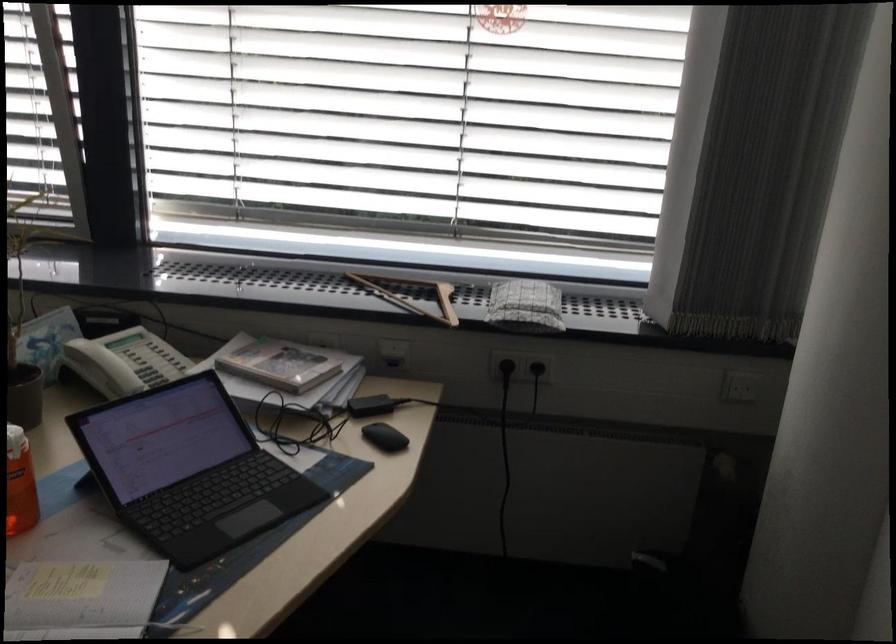
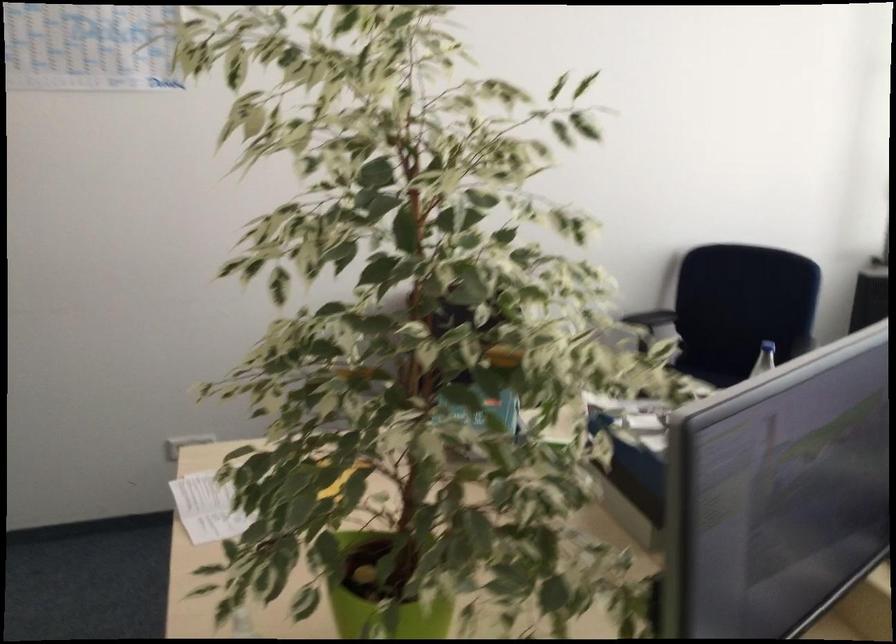
Question: The camera is either moving clockwise (left) or counter-clockwise (right) around the object. The first image is from the beginning of the video and the second image is from the end. Is the camera moving left or right when shooting the video?

Choices:
 (A) Left
 (B) Right

Answer: (B)